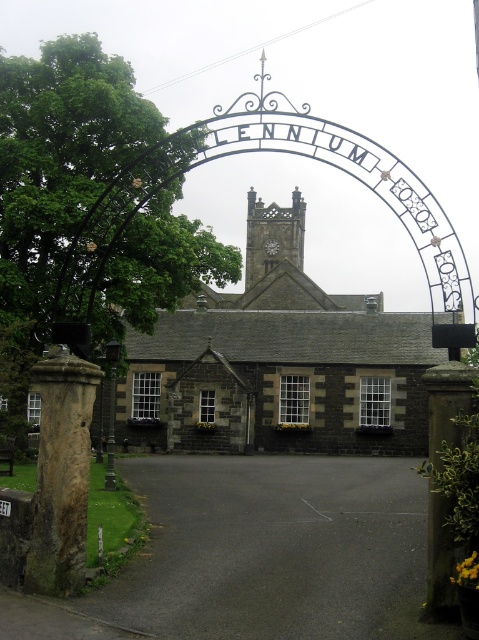
Between green leafy tree at left and brown stone pillar at left, which one appears on the right side from the viewer's perspective?

Positioned to the right is brown stone pillar at left.

Does green leafy tree at left appear over brown stone pillar at left?

Indeed, green leafy tree at left is positioned over brown stone pillar at left.

Is point (44, 72) positioned after point (41, 563)?

Yes.

The image size is (479, 640). I want to click on green leafy tree at left, so click(82, 205).

Looking at this image, between black asphalt driveway at center and dark gray stone church at center, which one appears on the left side from the viewer's perspective?

Positioned to the left is black asphalt driveway at center.

How much distance is there between black asphalt driveway at center and dark gray stone church at center?

black asphalt driveway at center and dark gray stone church at center are 45.69 meters apart.

Which is in front, point (344, 609) or point (145, 428)?

Point (344, 609) is more forward.

Locate an element on the screen. black asphalt driveway at center is located at coordinates (259, 556).

Can you confirm if brown stone pillar at left is positioned above brown stone pillar at right?

Yes.

Does brown stone pillar at left appear on the left side of brown stone pillar at right?

Indeed, brown stone pillar at left is positioned on the left side of brown stone pillar at right.

In the scene shown: Who is more distant from viewer, (82, 536) or (446, 547)?

Positioned behind is point (82, 536).

Find the location of a particular element. This screenshot has width=479, height=640. brown stone pillar at left is located at coordinates (60, 476).